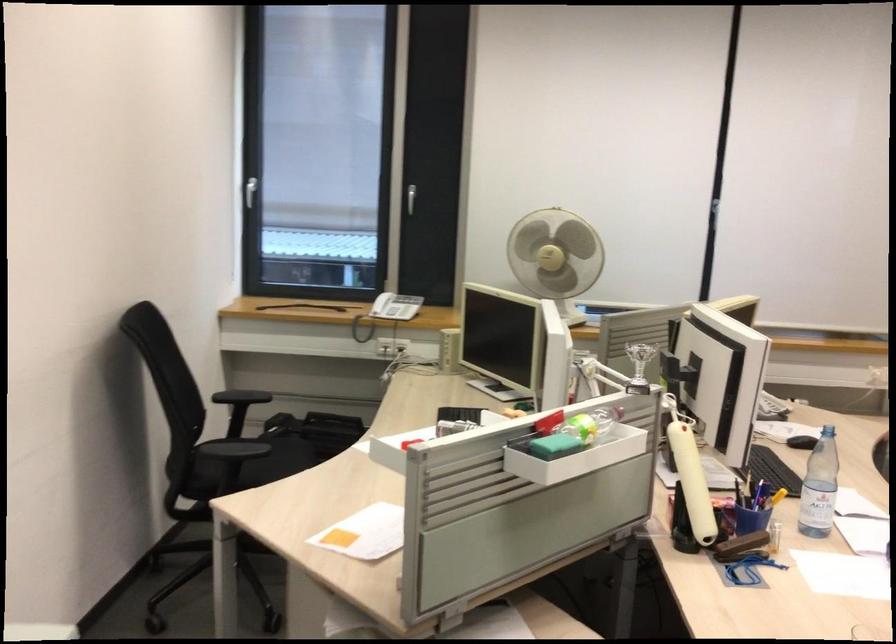
Image resolution: width=896 pixels, height=644 pixels. Find the location of `telephone handset`. telephone handset is located at coordinates (386, 312).